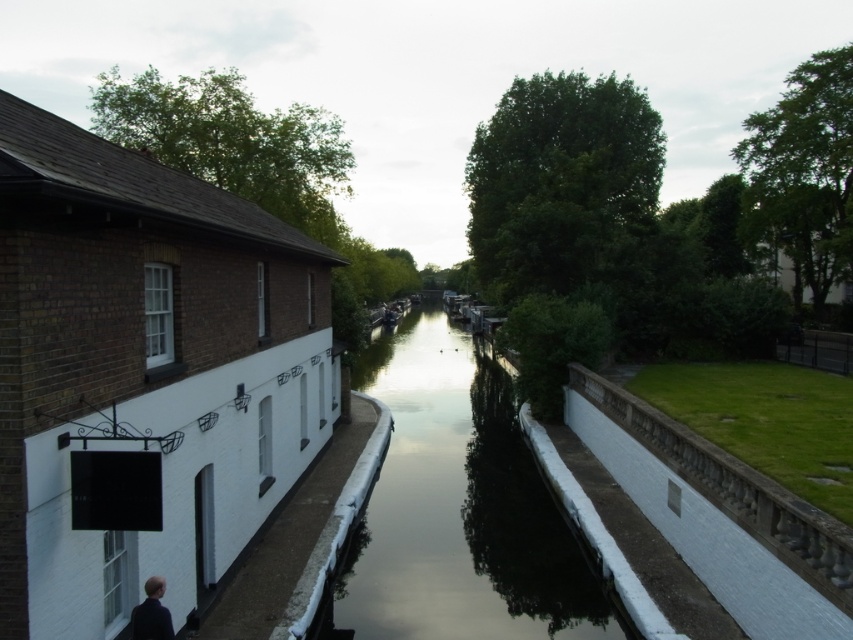
Question: Observing the image, what is the correct spatial positioning of smooth concrete canal at center in reference to dark blue fabric person at lower left?

Choices:
 (A) right
 (B) left

Answer: (A)

Question: Does smooth concrete canal at center come in front of dark blue fabric person at lower left?

Choices:
 (A) no
 (B) yes

Answer: (A)

Question: Which point is closer to the camera?

Choices:
 (A) smooth concrete canal at center
 (B) dark blue fabric person at lower left

Answer: (B)

Question: Which object appears closest to the camera in this image?

Choices:
 (A) smooth concrete canal at center
 (B) dark blue fabric person at lower left

Answer: (B)

Question: Does smooth concrete canal at center appear over dark blue fabric person at lower left?

Choices:
 (A) no
 (B) yes

Answer: (A)